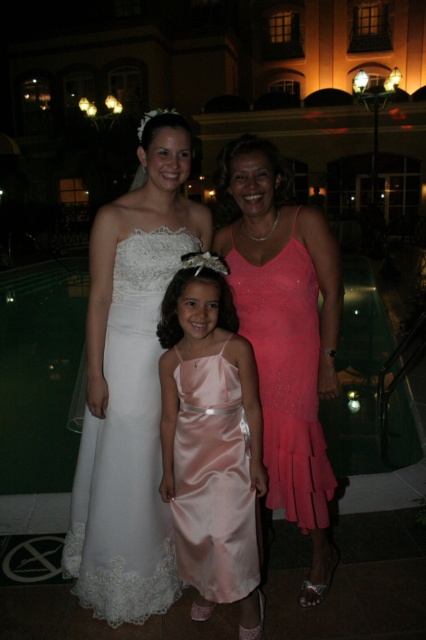
Which is in front, point (164, 481) or point (299, 282)?

Point (164, 481)

Is point (218, 416) positioned before point (310, 278)?

Yes, point (218, 416) is closer to viewer.

Identify the location of satin dress at center. This screenshot has height=640, width=426. (210, 440).

Between white satin dress at center and satin dress at center, which one appears on the right side from the viewer's perspective?

satin dress at center is more to the right.

Can you confirm if white satin dress at center is positioned to the left of satin dress at center?

Indeed, white satin dress at center is positioned on the left side of satin dress at center.

Is point (155, 352) positioned behind point (210, 564)?

Yes, point (155, 352) is farther from viewer.

Locate an element on the screen. white satin dress at center is located at coordinates (131, 387).

Can you confirm if white satin dress at center is positioned above shiny pink dress at center?

Indeed, white satin dress at center is positioned over shiny pink dress at center.

Between point (134, 540) and point (279, 353), which one is positioned in front?

Positioned in front is point (134, 540).

Is point (112, 353) positioned after point (287, 296)?

Yes, point (112, 353) is farther from viewer.

What are the coordinates of `white satin dress at center` in the screenshot? It's located at click(131, 387).